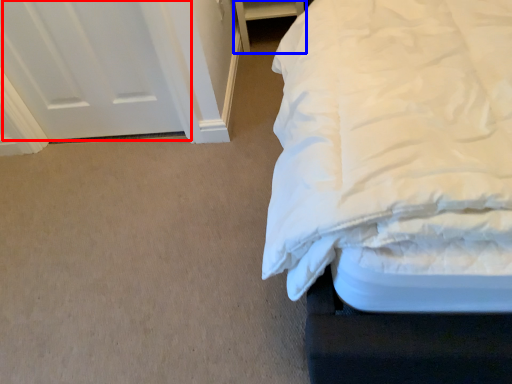
Question: Among these objects, which one is nearest to the camera, door (highlighted by a red box) or furniture (highlighted by a blue box)?

Choices:
 (A) door
 (B) furniture

Answer: (A)